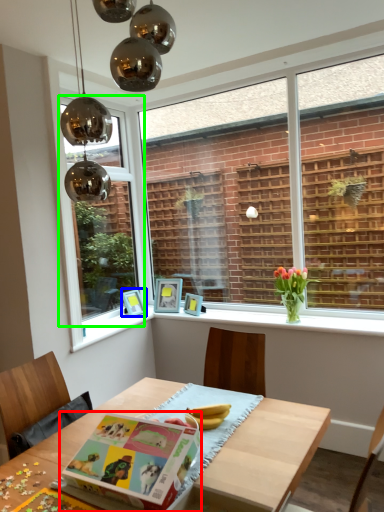
Question: Which is farther away from paperback book (highlighted by a red box)? picture frame (highlighted by a blue box) or window (highlighted by a green box)?

Choices:
 (A) picture frame
 (B) window

Answer: (A)